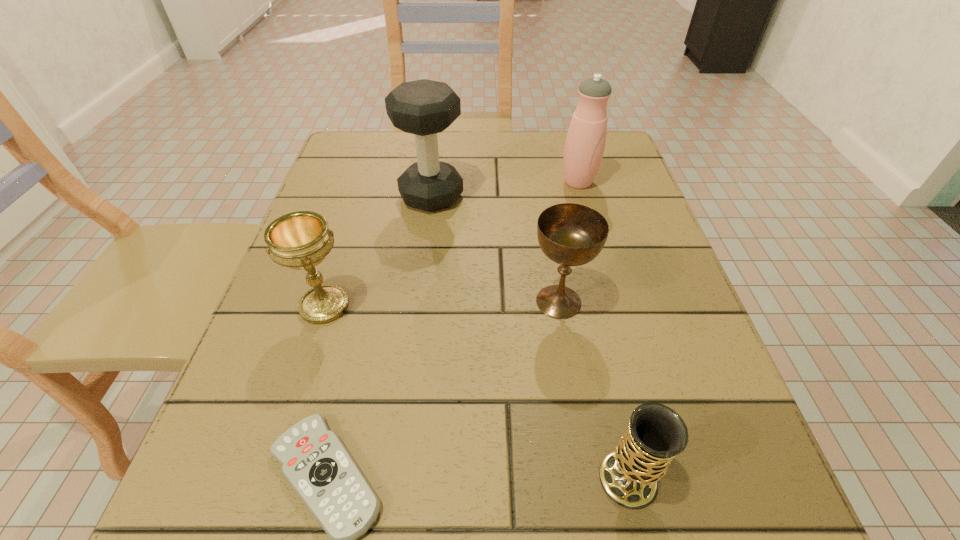
Locate which chalice ranks second in proximity to the shortest chalice. Please provide its 2D coordinates. Your answer should be formatted as a tuple, i.e. [(x, y)], where the tuple contains the x and y coordinates of a point satisfying the conditions above.

[(301, 240)]

At what (x,y) coordinates should I click in order to perform the action: click on vacant point that satisfies the following two spatial constraints: 1. on the back side of the dumbbell; 2. on the left side of the leftmost chalice. Please return your answer as a coordinate pair (x, y). The width and height of the screenshot is (960, 540). Looking at the image, I should click on (360, 196).

Find the location of a particular element. This screenshot has width=960, height=540. blank space that satisfies the following two spatial constraints: 1. on the back side of the leftmost chalice; 2. on the right side of the thermos bottle is located at coordinates (364, 182).

Find the location of a particular element. The height and width of the screenshot is (540, 960). vacant area that satisfies the following two spatial constraints: 1. on the front side of the leftmost chalice; 2. on the right side of the second shortest object is located at coordinates (269, 479).